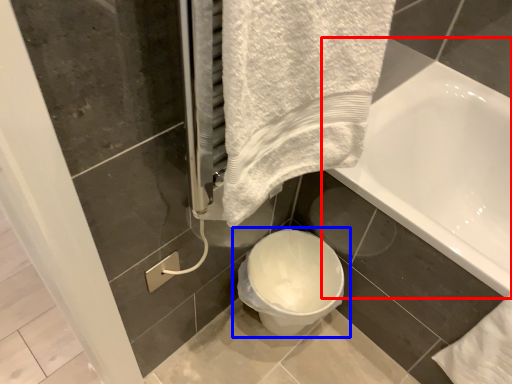
Question: Which object appears closest to the camera in this image, bathtub (highlighted by a red box) or toilet (highlighted by a blue box)?

Choices:
 (A) bathtub
 (B) toilet

Answer: (A)